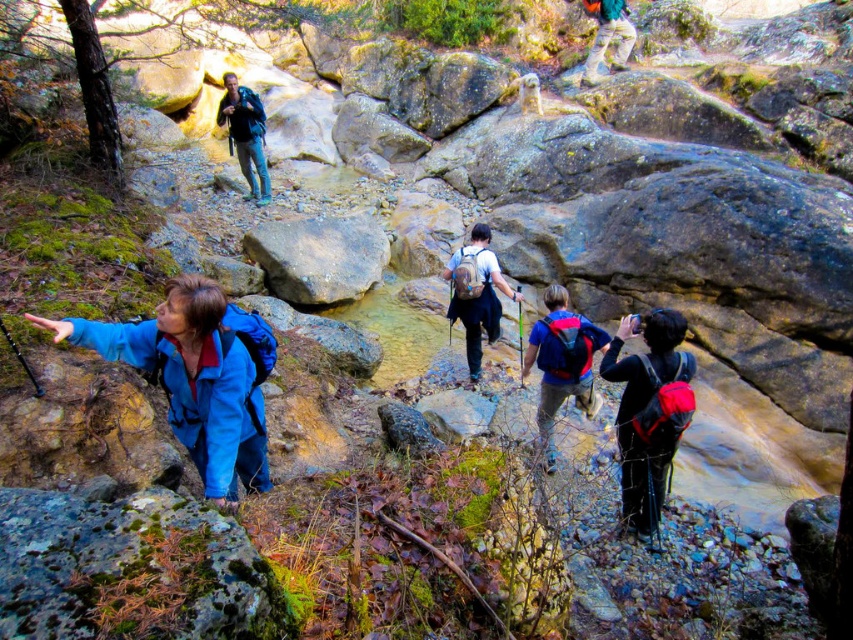
Looking at this image, you are a hiker who needs to place a marker at the point that is closer to the front of the group. Which point should you choose between point (212, 330) and point (236, 106)?

Point (212, 330) is in front of point (236, 106), so you should choose point (212, 330) to place the marker closer to the front of the group.

You are a hiker trying to locate your friend who is wearing a blue fabric jacket at lower left and carrying a matte black backpack at center. From your current position, which direction should you move to find your friend?

The blue fabric jacket at lower left is to the left of the matte black backpack at center. To locate your friend, you should move to the left side of the matte black backpack at center, where the blue fabric jacket at lower left is positioned.

You are a hiker planning to carry both the blue fabric jacket at lower left and the matte black backpack at center. Which item should you prioritize placing in an accessible location for quick access?

The blue fabric jacket at lower left is bigger than the matte black backpack at center, so it should be prioritized for placement in an accessible location to ensure quick access.